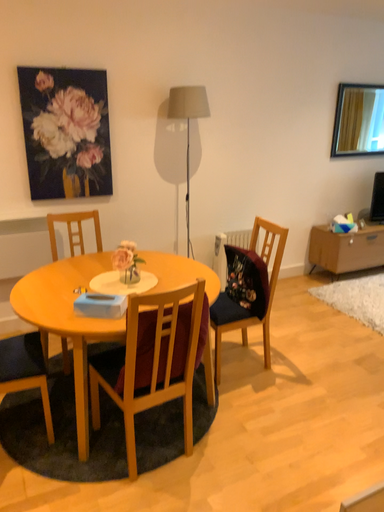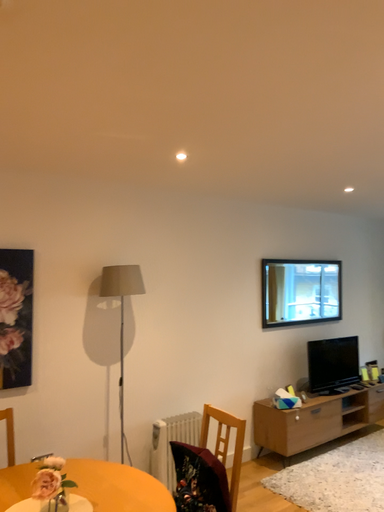
Question: Which way did the camera rotate in the video?

Choices:
 (A) rotated upward
 (B) rotated downward

Answer: (A)